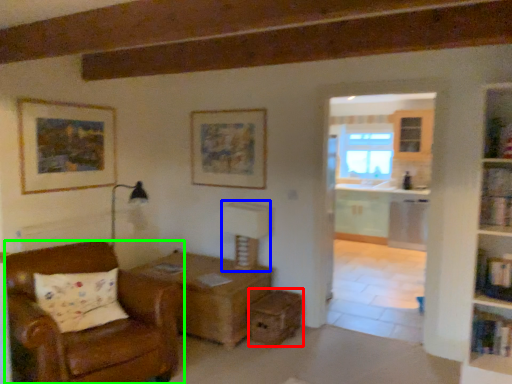
Question: Which is nearer to the drawer (highlighted by a red box)? table lamp (highlighted by a blue box) or chair (highlighted by a green box).

Choices:
 (A) table lamp
 (B) chair

Answer: (A)